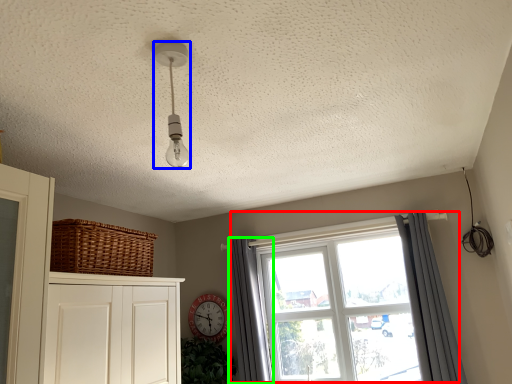
Question: Which object is the closest to the window (highlighted by a red box)? Choose among these: light fixture (highlighted by a blue box) or curtain (highlighted by a green box).

Choices:
 (A) light fixture
 (B) curtain

Answer: (B)